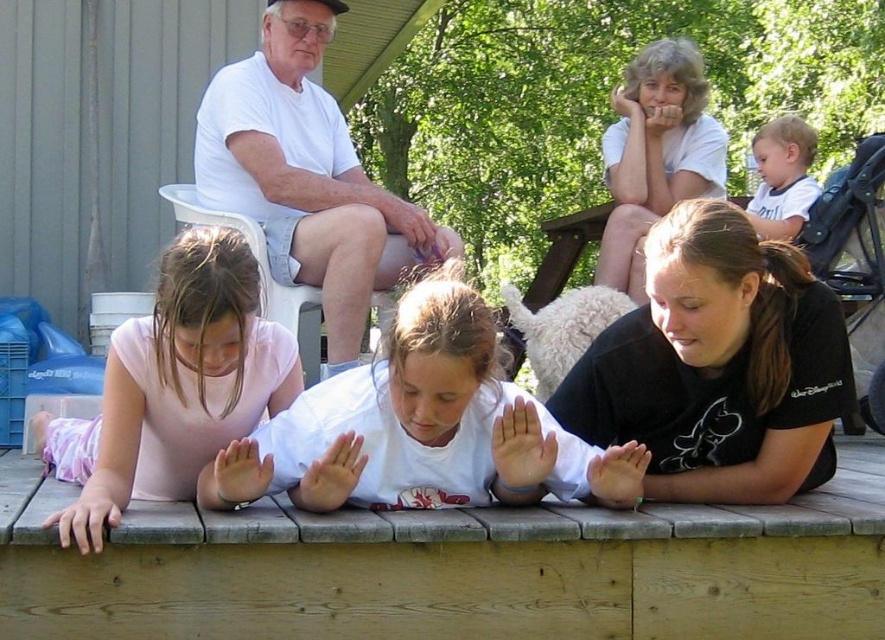
Question: Which point is closer to the camera?

Choices:
 (A) white matte shirt at upper center
 (B) white cotton shirt at upper left
 (C) light blue shirt at upper right
 (D) black matte shirt at lower right

Answer: (D)

Question: Can you confirm if black matte shirt at lower right is thinner than white cotton shirt at upper left?

Choices:
 (A) yes
 (B) no

Answer: (A)

Question: Which point is closer to the camera?

Choices:
 (A) white matte shirt at upper center
 (B) wooden at lower center

Answer: (B)

Question: Which of the following is the farthest from the observer?

Choices:
 (A) (668, 84)
 (B) (706, 497)
 (C) (274, 106)

Answer: (A)

Question: Is pink fabric shirt at lower left behind white cotton shirt at upper left?

Choices:
 (A) yes
 (B) no

Answer: (B)

Question: Does black matte shirt at lower right appear under pink fabric shirt at lower left?

Choices:
 (A) yes
 (B) no

Answer: (B)